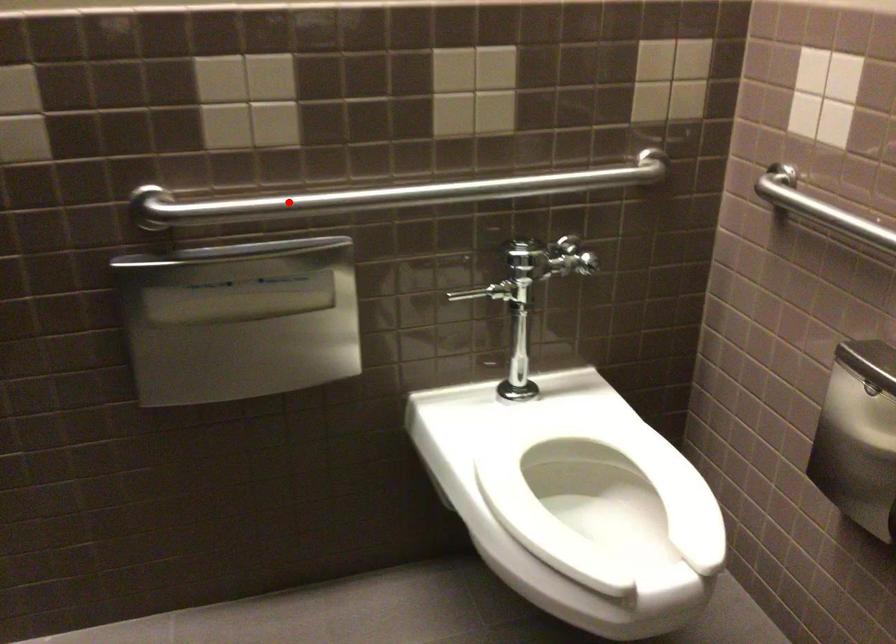
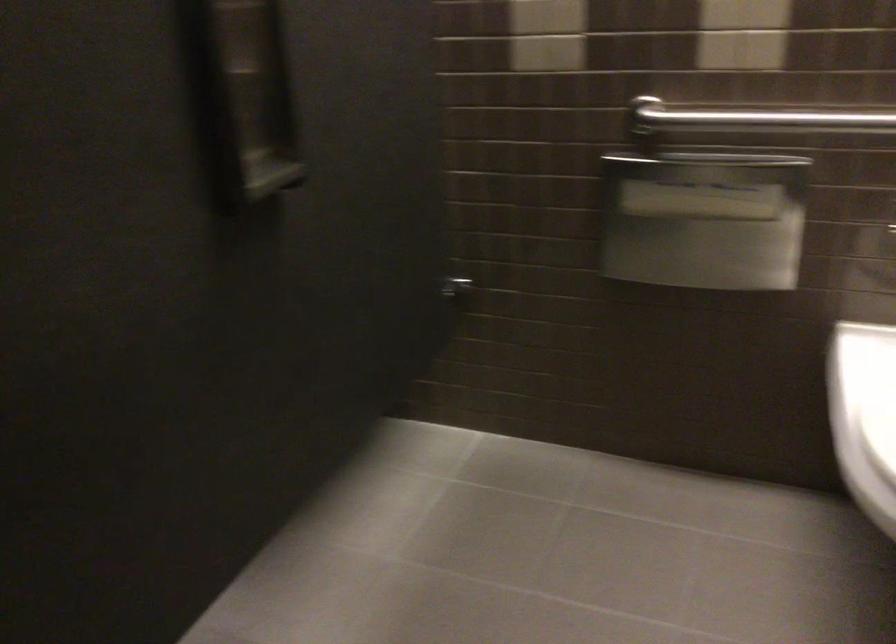
Question: I am providing you with two images of the same scene from different viewpoints. A red point is marked on the first image. At the location where the point appears in image 1, is it still visible in image 2?

Choices:
 (A) Yes
 (B) No

Answer: (A)